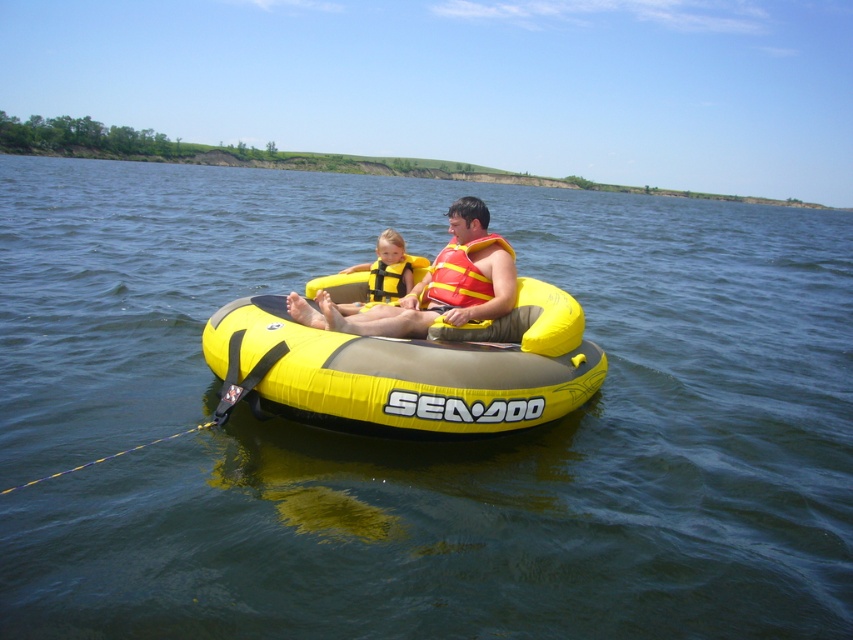
Question: Observing the image, what is the correct spatial positioning of yellow life vest at center in reference to yellow fabric life jacket at center?

Choices:
 (A) right
 (B) left

Answer: (B)

Question: Which object appears farthest from the camera in this image?

Choices:
 (A) yellow/inflatable boat at center
 (B) orange life vest at center

Answer: (B)

Question: Can you confirm if orange life vest at center is wider than yellow life vest at center?

Choices:
 (A) no
 (B) yes

Answer: (B)

Question: Which object is the closest to the yellow/inflatable boat at center?

Choices:
 (A) yellow life vest at center
 (B) yellow fabric life jacket at center

Answer: (B)

Question: Is orange life vest at center smaller than yellow fabric life jacket at center?

Choices:
 (A) no
 (B) yes

Answer: (A)

Question: Among these objects, which one is nearest to the camera?

Choices:
 (A) yellow/inflatable boat at center
 (B) yellow life vest at center
 (C) orange fabric life jacket at center
 (D) yellow fabric life jacket at center

Answer: (A)